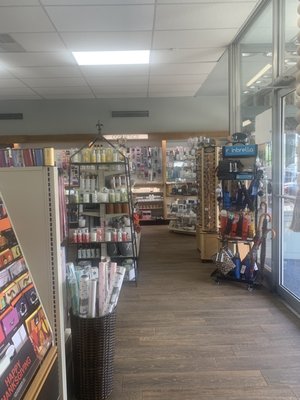
Identify the location of door. The width and height of the screenshot is (300, 400). (290, 240).